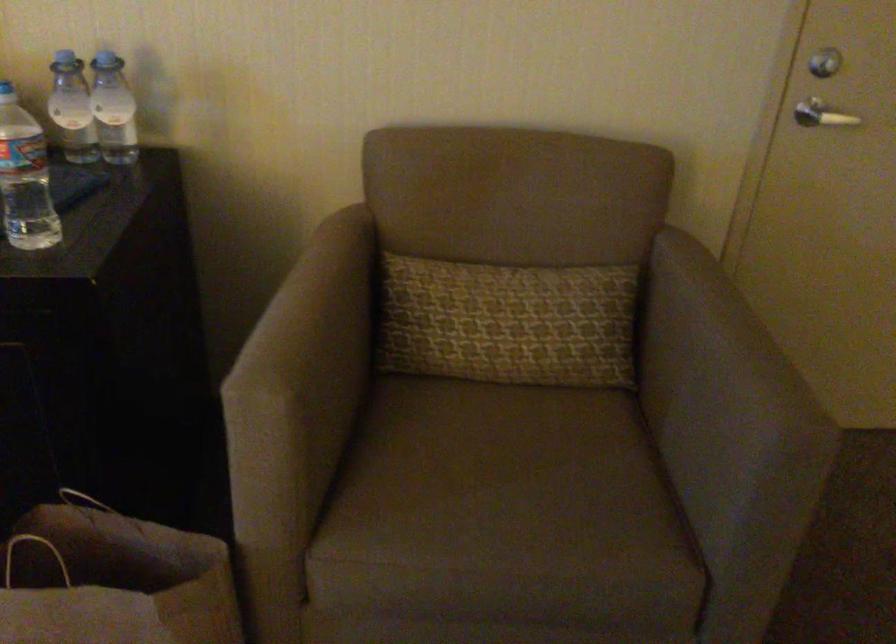
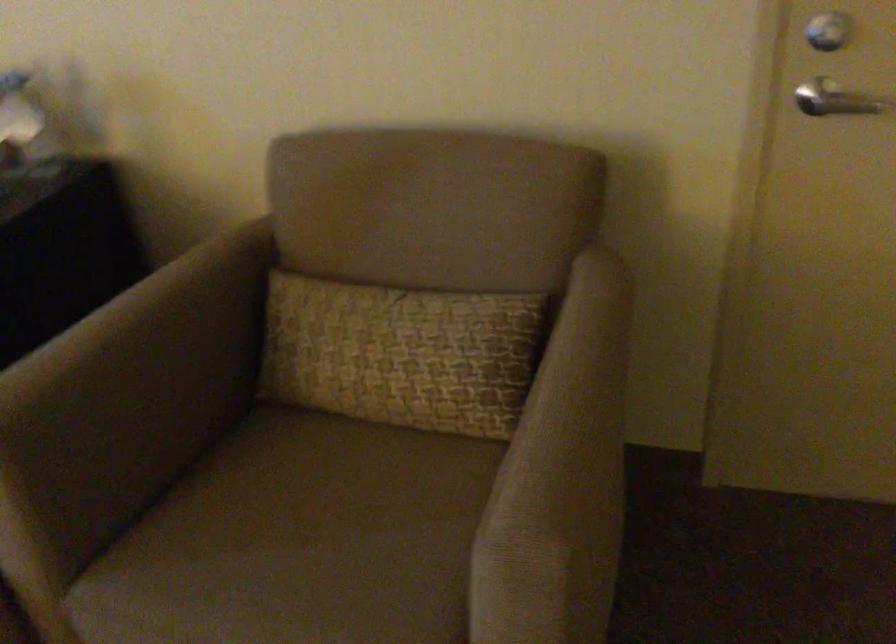
Which direction would the cameraman need to move to produce the second image?

The movement direction of the cameraman is right, forward.